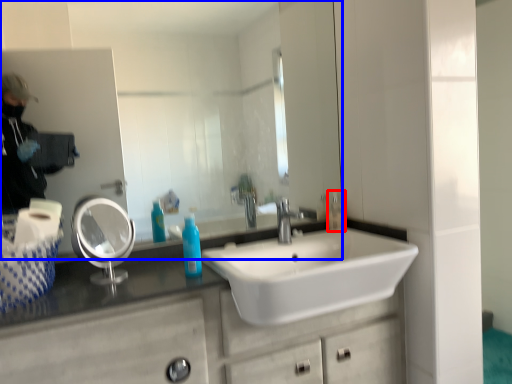
Question: Which object is further to the camera taking this photo, toiletry (highlighted by a red box) or mirror (highlighted by a blue box)?

Choices:
 (A) toiletry
 (B) mirror

Answer: (A)